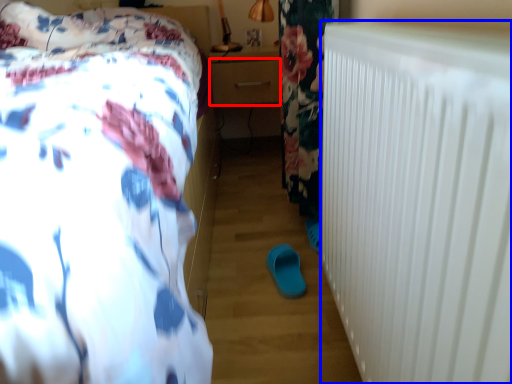
Question: Which of the following is the closest to the observer, drawer (highlighted by a red box) or radiator (highlighted by a blue box)?

Choices:
 (A) drawer
 (B) radiator

Answer: (B)